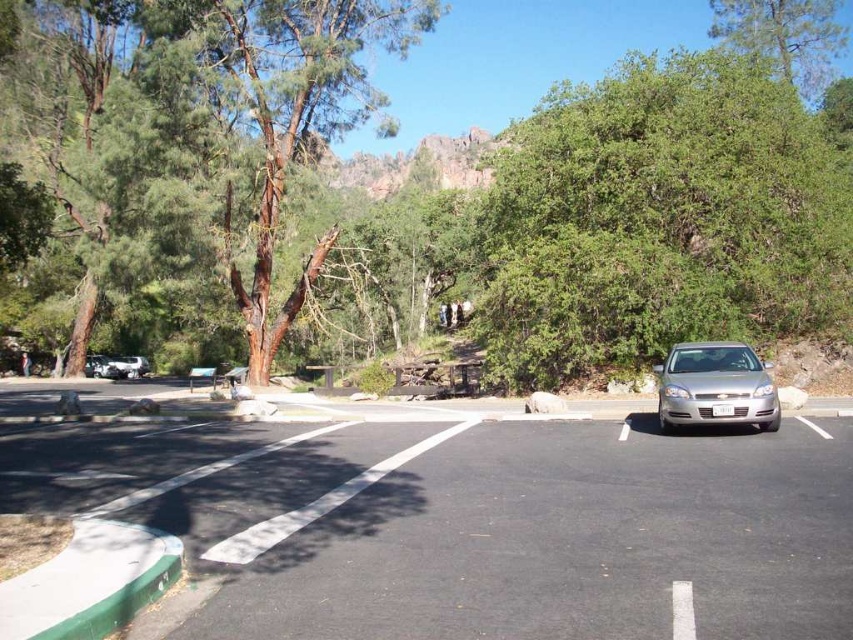
You are standing at the entrance of the park and want to find the black asphalt parking lot at center. According to the map coordinates provided, where should you look to locate it?

The black asphalt parking lot at center is located at point (x=473, y=522) on the map, so you should look towards the coordinates 0.817 on the x axis and 0.555 on the y axis to find it.

You are a landscape architect planning to add a new bench in the park. You want to place it where it can be seen from both the green rough bark tree at upper left and the green leafy tree at upper right. Considering their sizes, which tree area would allow the bench to be more visible?

The bench should be placed near the green rough bark tree at upper left because it occupies less space than the green leafy tree at upper right, providing a clearer view from both locations.

You are a delivery driver who needs to park your truck in the black asphalt parking lot at center. However, the satin silver sedan at right is blocking the entrance. Can you drive around it to access the parking lot?

The black asphalt parking lot at center is located below the satin silver sedan at right, so you can drive around the sedan by moving to the left side of it to access the parking lot.